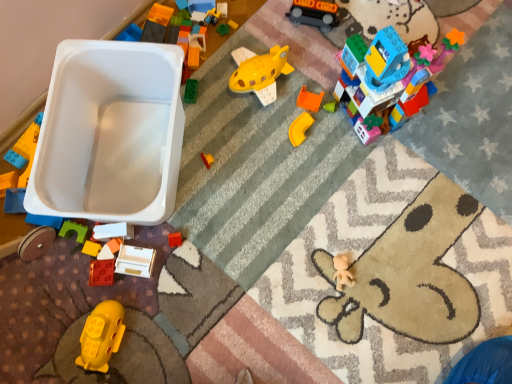
You are a GUI agent. You are given a task and a screenshot of the screen. Output one action in this format:
    pyautogui.click(x=<x>, y=<y>)
    Task: Click on the free space between white matte block at lower left, which is the fifth toy from right to left, and shiny black train at upper center, the 7th toy when ordered from left to right
    The height and width of the screenshot is (384, 512).
    Given the screenshot: What is the action you would take?
    pyautogui.click(x=224, y=118)